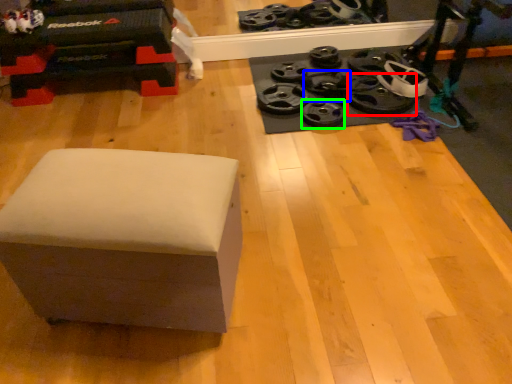
Question: Which is nearer to the wheel (highlighted by a red box)? wheel (highlighted by a blue box) or wheel (highlighted by a green box).

Choices:
 (A) wheel
 (B) wheel

Answer: (A)